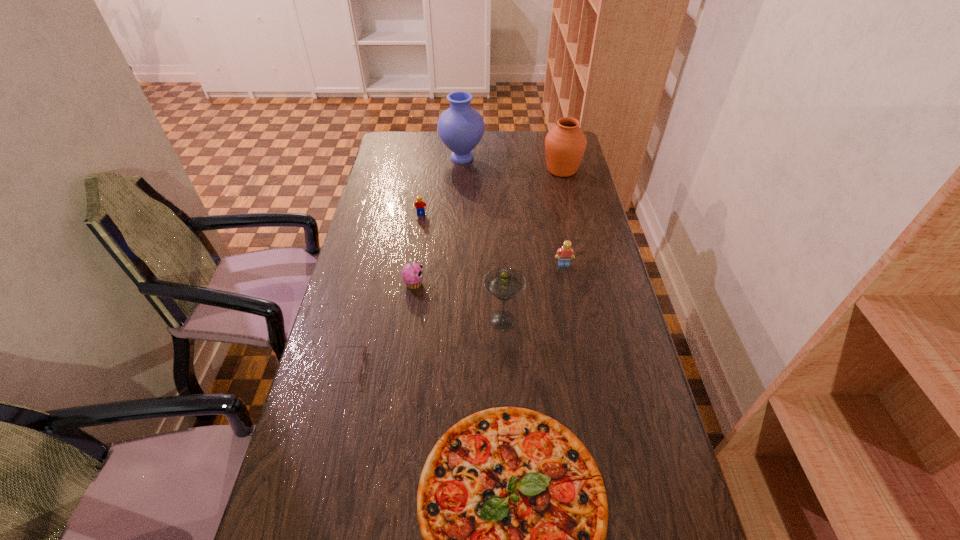
Locate an element on the screen. The height and width of the screenshot is (540, 960). the tallest object is located at coordinates coord(460,127).

The height and width of the screenshot is (540, 960). I want to click on urn, so click(x=565, y=144).

Locate an element on the screen. martini is located at coordinates (504, 283).

In order to click on the fifth farthest object in this screenshot , I will do `click(412, 273)`.

What are the coordinates of `the taller Lego` in the screenshot? It's located at (564, 254).

At what (x,y) coordinates should I click in order to perform the action: click on the fourth farthest object. Please return your answer as a coordinate pair (x, y). The height and width of the screenshot is (540, 960). Looking at the image, I should click on (564, 254).

I want to click on the sixth nearest object, so click(x=419, y=205).

Where is `the left Lego`? the left Lego is located at coordinates (419, 205).

Locate an element on the screen. the leftmost object is located at coordinates (364, 350).

The image size is (960, 540). Find the location of `the second nearest object`. the second nearest object is located at coordinates (364, 350).